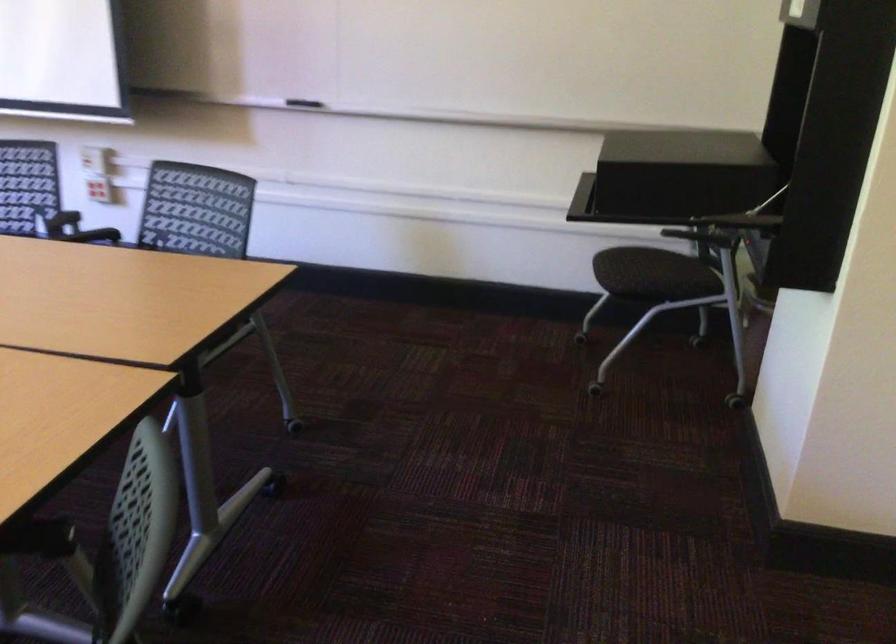
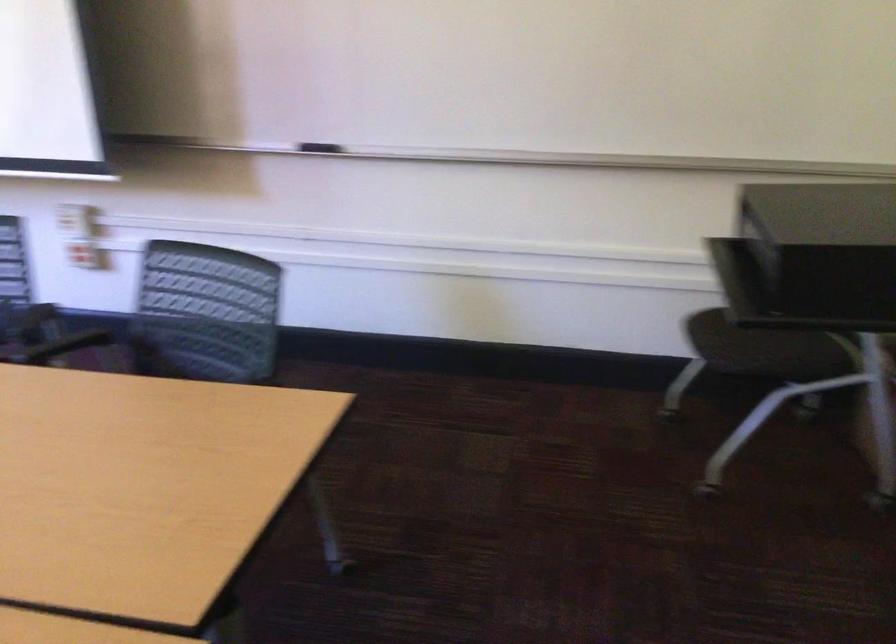
The point at (300, 99) is marked in the first image. Where is the corresponding point in the second image?

(319, 147)